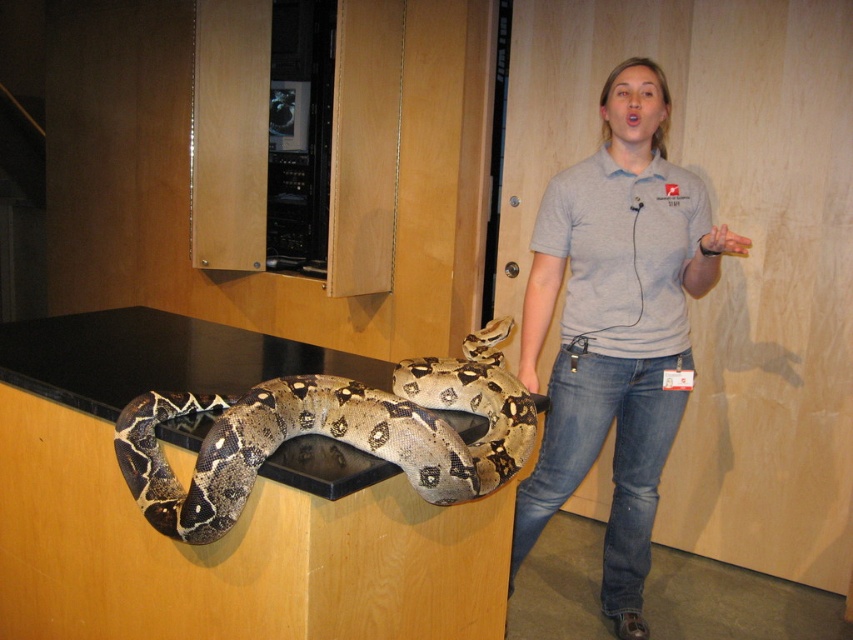
You are standing in front of the snake and want to reach an object located at point [550,484] and another object at point [169,474]. Which point is closer to you?

Point [169,474] is closer to you because it is less further to the camera than point [550,484].

You are a photographer trying to capture the brown patterned snake at center without the gray cotton shirt at center blocking the view. Can you move to a position where the snake is fully visible?

The brown patterned snake at center is behind the gray cotton shirt at center, so moving around the shirt might allow you to see the snake. However, since both are at the center, it might be challenging to fully see the snake without the shirt blocking part of it.